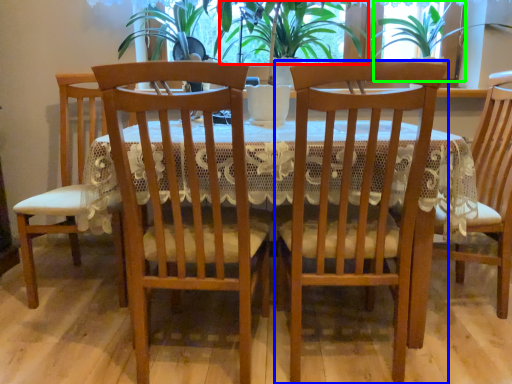
Question: Which object is positioned farthest from plant (highlighted by a red box)? Select from chair (highlighted by a blue box) and window screen (highlighted by a green box).

Choices:
 (A) chair
 (B) window screen

Answer: (A)